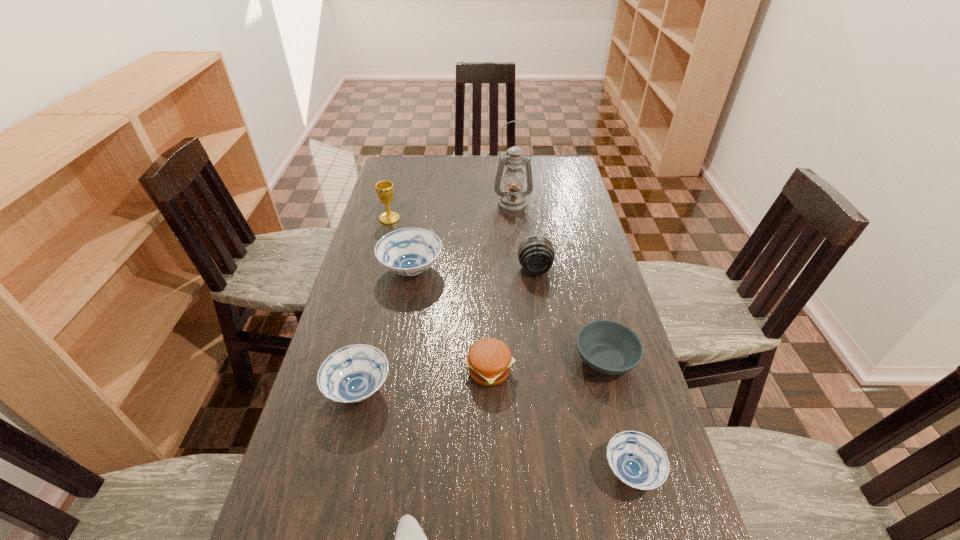
The height and width of the screenshot is (540, 960). I want to click on object that stands as the closest to the gray soup bowl, so click(636, 459).

Identify which object is located as the nearest to the second tallest soup bowl. Please provide its 2D coordinates. Your answer should be formatted as a tuple, i.e. [(x, y)], where the tuple contains the x and y coordinates of a point satisfying the conditions above.

[(489, 360)]

Locate which soup bowl is the second closest to the tallest object. Please provide its 2D coordinates. Your answer should be formatted as a tuple, i.e. [(x, y)], where the tuple contains the x and y coordinates of a point satisfying the conditions above.

[(609, 347)]

You are a GUI agent. You are given a task and a screenshot of the screen. Output one action in this format:
    pyautogui.click(x=<x>, y=<y>)
    Task: Click on the soup bowl identified as the second closest to the white control
    This screenshot has width=960, height=540.
    Given the screenshot: What is the action you would take?
    pyautogui.click(x=636, y=459)

Identify the location of the second closest blue soup bowl relative to the fourth tallest object. Image resolution: width=960 pixels, height=540 pixels. (636, 459).

Find the location of a particular element. blue soup bowl that is the closest to the nearest object is located at coordinates pos(352,374).

Locate an element on the screen. vacant area that satisfies the following two spatial constraints: 1. on the front side of the biggest blue soup bowl; 2. on the left side of the hamburger is located at coordinates [x=394, y=370].